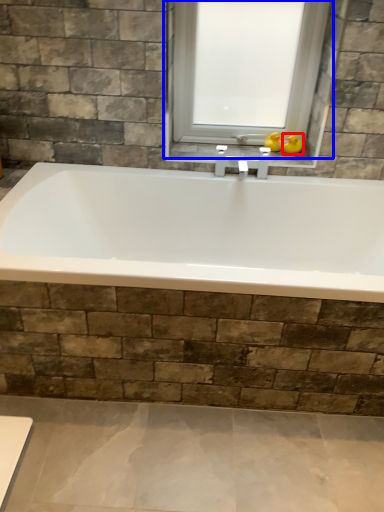
Question: Which point is further to the camera, duck (highlighted by a red box) or window (highlighted by a blue box)?

Choices:
 (A) duck
 (B) window

Answer: (A)